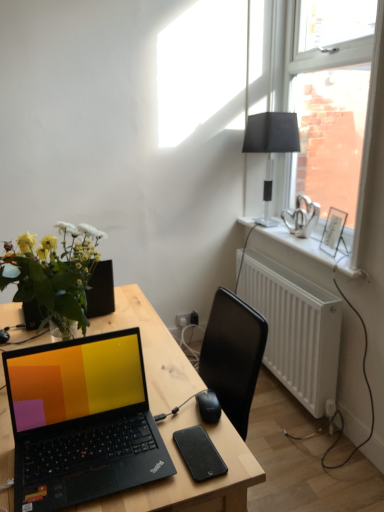
Where is `vacant area that is in front of black plastic mouse at center`? The image size is (384, 512). vacant area that is in front of black plastic mouse at center is located at coordinates (197, 457).